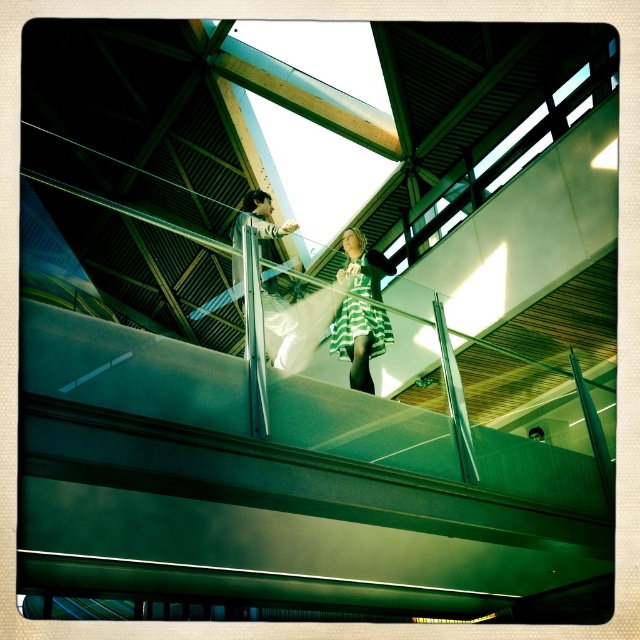
Between striped jersey dress at center and green striped dress at center, which one appears on the left side from the viewer's perspective?

striped jersey dress at center is more to the left.

Does point (310, 352) come closer to viewer compared to point (352, 312)?

That is True.

Between point (244, 218) and point (339, 320), which one is positioned in front?

Point (244, 218)

The width and height of the screenshot is (640, 640). In order to click on striped jersey dress at center in this screenshot , I will do `click(294, 323)`.